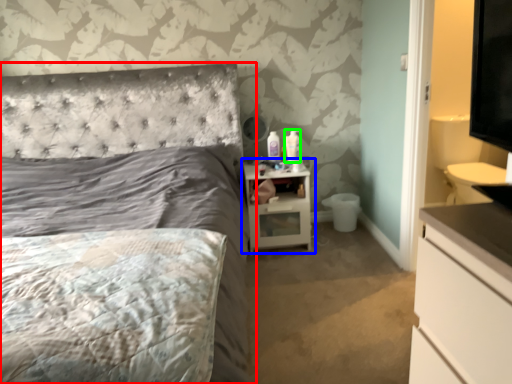
Question: Estimate the real-world distances between objects in this image. Which object is farther from bed (highlighted by a red box), nightstand (highlighted by a blue box) or toiletry (highlighted by a green box)?

Choices:
 (A) nightstand
 (B) toiletry

Answer: (B)